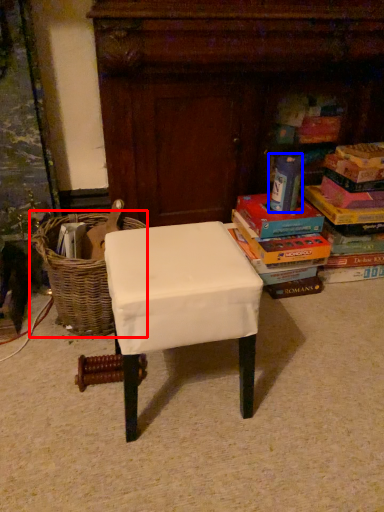
Question: Which point is further to the camera, basket (highlighted by a red box) or paperback book (highlighted by a blue box)?

Choices:
 (A) basket
 (B) paperback book

Answer: (B)